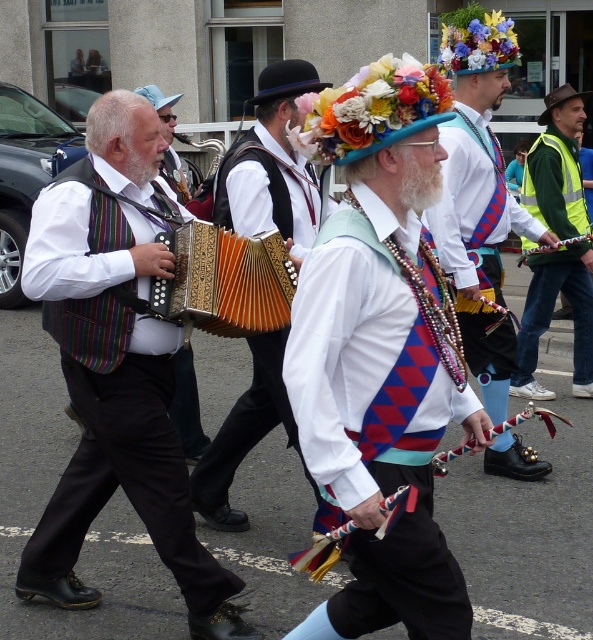
Question: Which of these objects is positioned closest to the striped fabric vest at left?

Choices:
 (A) matte black shoes at center
 (B) green reflective vest at right
 (C) gold textured accordion at center

Answer: (C)

Question: Which point is closer to the camera taking this photo?

Choices:
 (A) (72, 218)
 (B) (534, 362)
 (C) (216, 282)

Answer: (A)

Question: Which point is closer to the camera taking this photo?

Choices:
 (A) (530, 259)
 (B) (215, 234)

Answer: (B)

Question: Can you confirm if striped fabric vest at left is positioned to the left of matte black accordion at center?

Choices:
 (A) no
 (B) yes

Answer: (B)

Question: Does matte black shoes at center have a smaller size compared to green reflective vest at right?

Choices:
 (A) yes
 (B) no

Answer: (B)

Question: Does striped fabric vest at left have a smaller size compared to gold textured accordion at center?

Choices:
 (A) yes
 (B) no

Answer: (B)